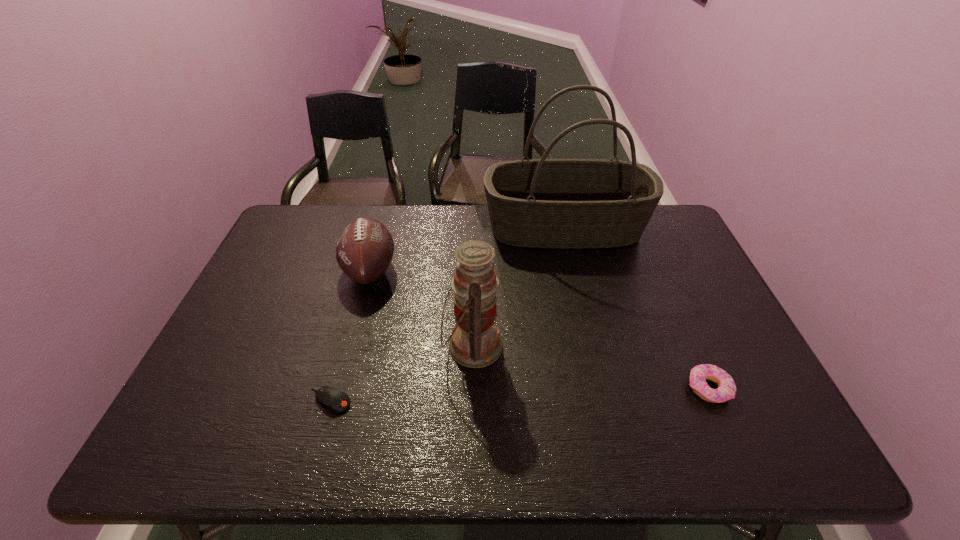
The width and height of the screenshot is (960, 540). What are the coordinates of `free space at the far right corner` in the screenshot? It's located at (649, 228).

Identify the location of free space between the shortest object and the football (American). The image size is (960, 540). (349, 335).

You are a GUI agent. You are given a task and a screenshot of the screen. Output one action in this format:
    pyautogui.click(x=<x>, y=<y>)
    Task: Click on the vacant space that's between the fourth tallest object and the basket
    The height and width of the screenshot is (540, 960).
    Given the screenshot: What is the action you would take?
    pyautogui.click(x=636, y=308)

What are the coordinates of `free space between the third shortest object and the shortest object` in the screenshot? It's located at (349, 335).

In order to click on vacant area between the second tallest object and the tallest object in this screenshot , I will do `click(518, 287)`.

Where is `blank region between the shortest object and the oil lamp`? Image resolution: width=960 pixels, height=540 pixels. blank region between the shortest object and the oil lamp is located at coordinates click(401, 373).

Identify the location of vacant area that lies between the oil lamp and the third tallest object. The width and height of the screenshot is (960, 540). (421, 308).

The width and height of the screenshot is (960, 540). Identify the location of vacant area that lies between the second shortest object and the oil lamp. (590, 367).

Locate an element on the screen. This screenshot has height=540, width=960. vacant area between the third shortest object and the second tallest object is located at coordinates (421, 308).

Find the location of a particular element. The height and width of the screenshot is (540, 960). unoccupied position between the tallest object and the doughnut is located at coordinates (636, 308).